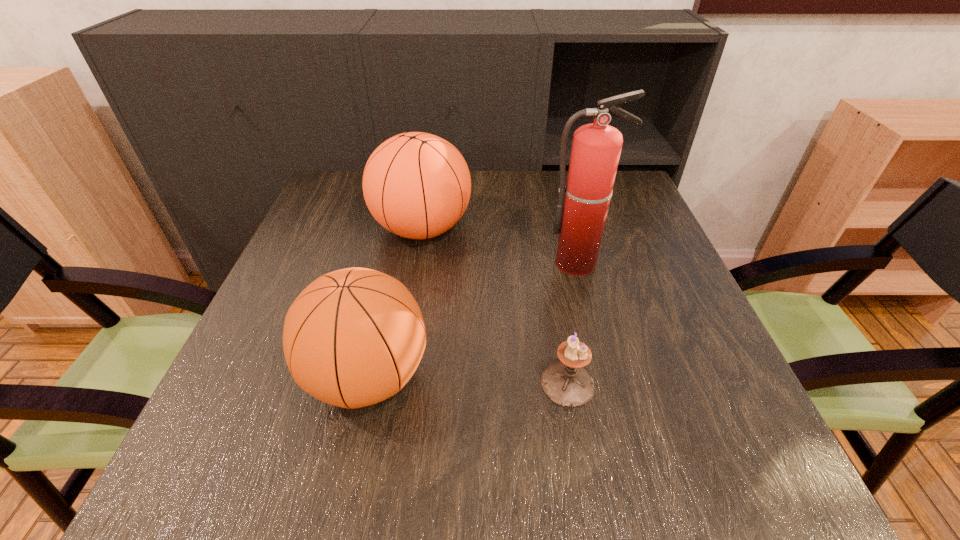
This screenshot has width=960, height=540. What are the coordinates of `fire extinguisher` in the screenshot? It's located at click(x=596, y=148).

This screenshot has width=960, height=540. I want to click on the farther basketball, so click(x=417, y=185).

In order to click on the nearer basketball in this screenshot , I will do `click(354, 337)`.

Locate an element on the screen. This screenshot has height=540, width=960. the shortest object is located at coordinates (567, 384).

Where is `blank space located 0.370m with the nozzle and gauge on the tallest object`? This screenshot has height=540, width=960. blank space located 0.370m with the nozzle and gauge on the tallest object is located at coordinates pyautogui.click(x=621, y=431).

Image resolution: width=960 pixels, height=540 pixels. Find the location of `free region located 0.360m on the right of the farther basketball`. free region located 0.360m on the right of the farther basketball is located at coordinates (615, 228).

Where is `free space located on the right of the nearer basketball`? This screenshot has height=540, width=960. free space located on the right of the nearer basketball is located at coordinates (556, 377).

Identify the location of vacant space located on the back of the shortest object. (546, 260).

Where is `object that is positioned at the far edge`? object that is positioned at the far edge is located at coordinates (417, 185).

Where is `object present at the left edge`? The image size is (960, 540). object present at the left edge is located at coordinates (354, 337).